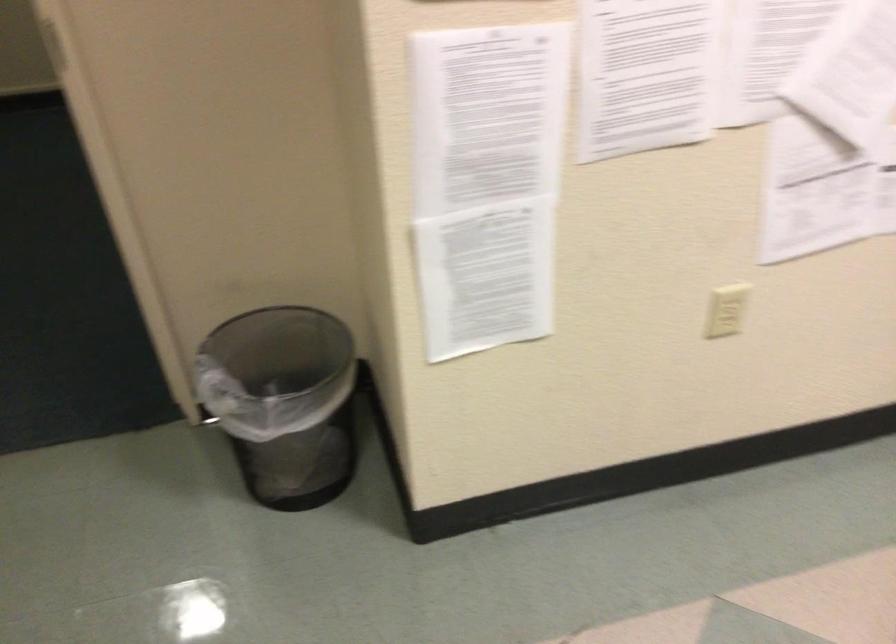
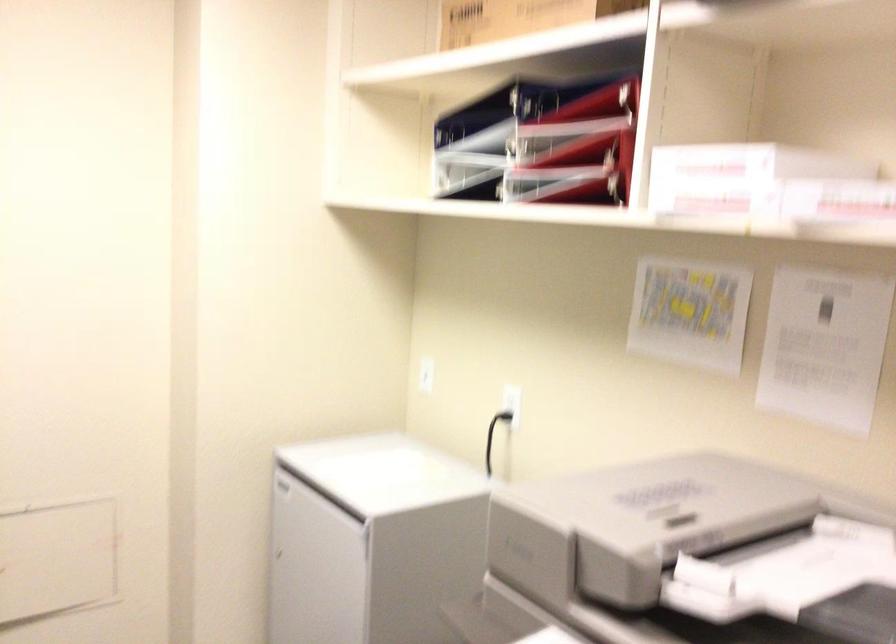
Based on the continuous images, in which direction is the camera rotating?

The camera's rotation is toward right-down.